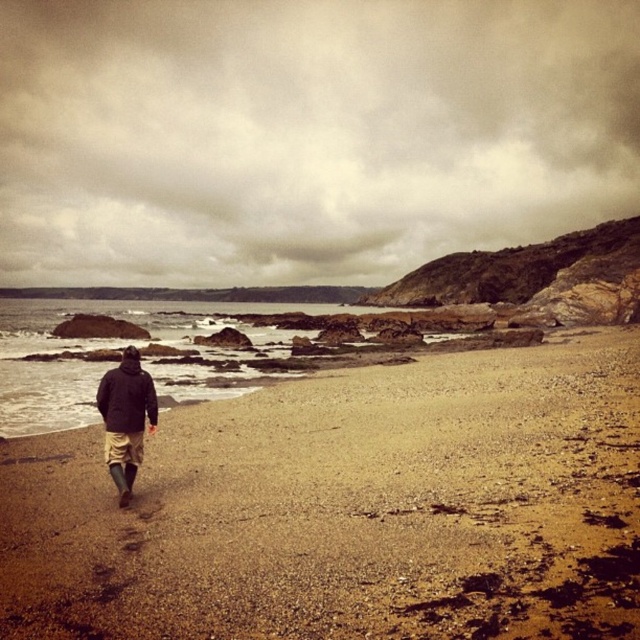
Which is more to the left, brown gravelly sand at center or dark brown leather jacket at center?

dark brown leather jacket at center

Can you confirm if brown gravelly sand at center is positioned below dark brown leather jacket at center?

Yes, brown gravelly sand at center is below dark brown leather jacket at center.

The image size is (640, 640). I want to click on brown gravelly sand at center, so click(x=348, y=508).

Locate an element on the screen. The image size is (640, 640). cloudy sky at upper center is located at coordinates (305, 134).

Consider the image. Is cloudy sky at upper center further to the viewer compared to brown gravelly sand at center?

Yes.

Locate an element on the screen. The width and height of the screenshot is (640, 640). cloudy sky at upper center is located at coordinates (305, 134).

Where is `cloudy sky at upper center`? This screenshot has width=640, height=640. cloudy sky at upper center is located at coordinates (305, 134).

Between point (125, 493) and point (125, 358), which one is positioned in front?

Positioned in front is point (125, 493).

Find the location of a particular element. dark brown leather jacket at center is located at coordinates (125, 419).